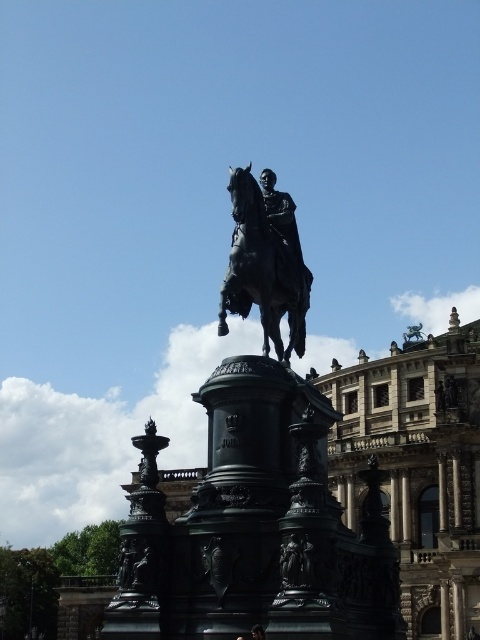
Question: Does black polished statue at center appear on the left side of dark brown hair at center?

Choices:
 (A) yes
 (B) no

Answer: (B)

Question: Which point is closer to the camera taking this photo?

Choices:
 (A) (267, 305)
 (B) (310, 468)
 (C) (262, 630)

Answer: (C)

Question: Which object is closer to the camera taking this photo?

Choices:
 (A) shiny black horse at center
 (B) black polished statue at center
 (C) dark brown hair at center

Answer: (B)

Question: Does shiny black horse at center have a smaller size compared to dark brown hair at center?

Choices:
 (A) yes
 (B) no

Answer: (B)

Question: Estimate the real-world distances between objects in this image. Which object is farther from the dark brown hair at center?

Choices:
 (A) shiny black horse at center
 (B) black polished statue at center

Answer: (A)

Question: Can you confirm if shiny black horse at center is smaller than dark brown hair at center?

Choices:
 (A) yes
 (B) no

Answer: (B)